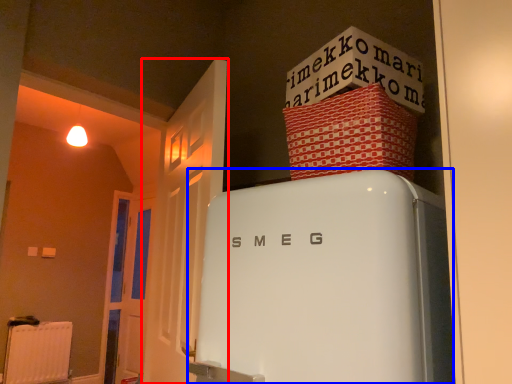
Question: Which object is further to the camera taking this photo, door (highlighted by a red box) or refrigerator (highlighted by a blue box)?

Choices:
 (A) door
 (B) refrigerator

Answer: (A)